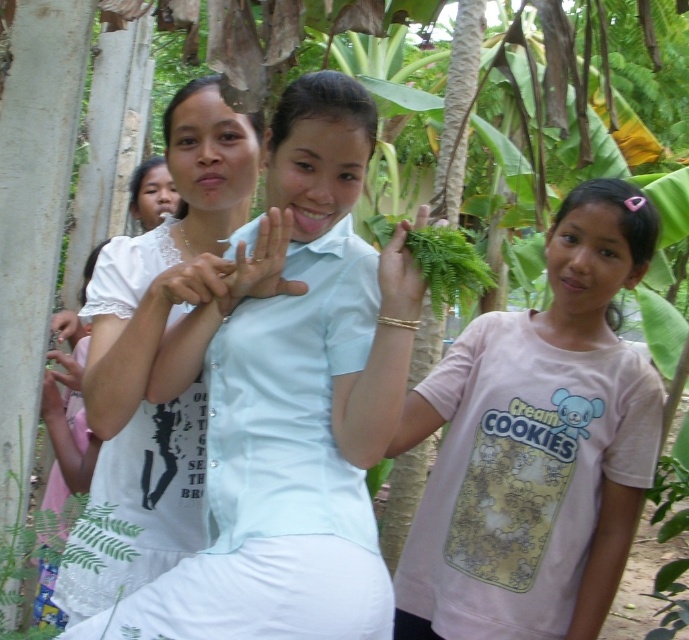
In the scene shown: You are a photographer trying to capture a closeup of the gold bracelet at center and the matte white hand at lower left in the scene. Since you can only focus on one object at a time, which object should you choose to ensure it appears larger in the photo?

The gold bracelet at center has a greater height compared to the matte white hand at lower left, so you should focus on the gold bracelet at center to ensure it appears larger in the photo.

You are a photographer trying to capture a closeup shot of the gold bracelet at center and the matte white hand at lower left. Based on the scene described, can you fit both subjects into the frame without moving the camera? Explain your reasoning.

The gold bracelet at center and the matte white hand at lower left are 4.47 feet apart. Since the distance between them is significant, it may be challenging to capture both in a single closeup frame without adjusting the camera angle or zoom. However, using a wider lens or moving the camera back slightly could help include both subjects within the frame.

You are a photographer capturing a group photo of the white matte hand at center and the matte white hand at lower left. To ensure both hands are in focus, which hand should you focus on first?

The white matte hand at center is closer to the viewer than the matte white hand at lower left, so you should focus on the white matte hand at center first to ensure both are in focus.